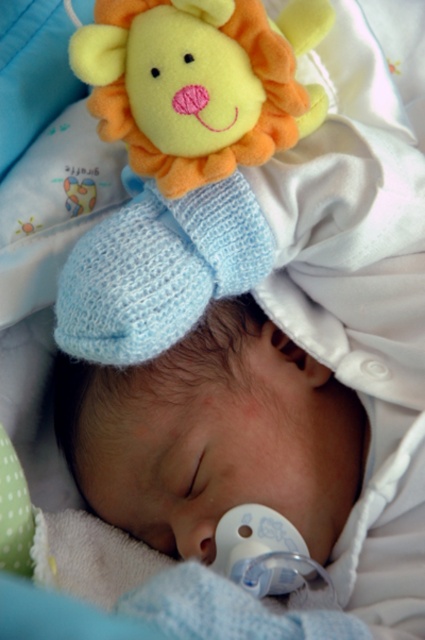
Question: Among these points, which one is farthest from the camera?

Choices:
 (A) (155, 58)
 (B) (144, 410)

Answer: (B)

Question: Which point is farther to the camera?

Choices:
 (A) 99,236
 (B) 215,355

Answer: (B)

Question: Is soft yellow plush lion at upper center to the left of white smooth pacifier at center from the viewer's perspective?

Choices:
 (A) no
 (B) yes

Answer: (B)

Question: Can you confirm if soft yellow plush lion at upper center is positioned below white smooth pacifier at center?

Choices:
 (A) yes
 (B) no

Answer: (B)

Question: Is soft yellow plush lion at upper center below white smooth pacifier at center?

Choices:
 (A) no
 (B) yes

Answer: (A)